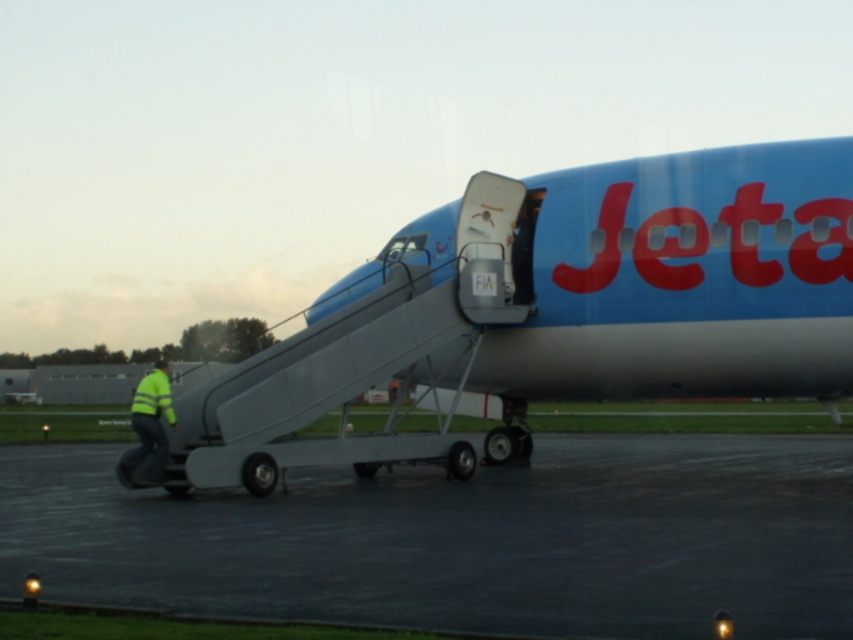
Question: Which object is the farthest from the black asphalt tarmac at lower center?

Choices:
 (A) blue matte airplane at center
 (B) yellow reflective jacket at lower left

Answer: (A)

Question: Which of the following is the farthest from the observer?

Choices:
 (A) (355, 317)
 (B) (828, 557)

Answer: (A)

Question: Does blue matte airplane at center appear on the left side of black asphalt tarmac at lower center?

Choices:
 (A) no
 (B) yes

Answer: (A)

Question: Which of the following is the closest to the observer?

Choices:
 (A) black asphalt tarmac at lower center
 (B) blue matte airplane at center
 (C) yellow reflective jacket at lower left

Answer: (A)

Question: Is black asphalt tarmac at lower center bigger than yellow reflective jacket at lower left?

Choices:
 (A) yes
 (B) no

Answer: (A)

Question: Considering the relative positions of black asphalt tarmac at lower center and yellow reflective jacket at lower left in the image provided, where is black asphalt tarmac at lower center located with respect to yellow reflective jacket at lower left?

Choices:
 (A) above
 (B) below

Answer: (A)